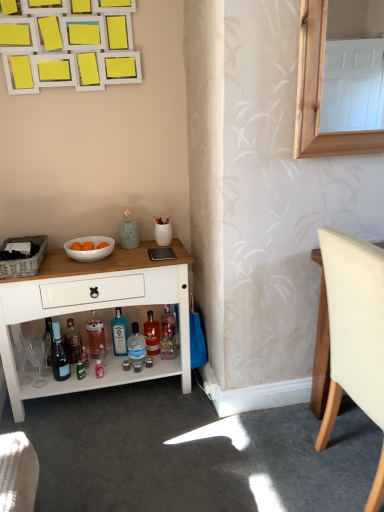
You are a GUI agent. You are given a task and a screenshot of the screen. Output one action in this format:
    pyautogui.click(x=<x>, y=<y>)
    Task: Click on the free spot above white wood cabinet at lower left (from a real-world perspective)
    
    Given the screenshot: What is the action you would take?
    pyautogui.click(x=100, y=261)